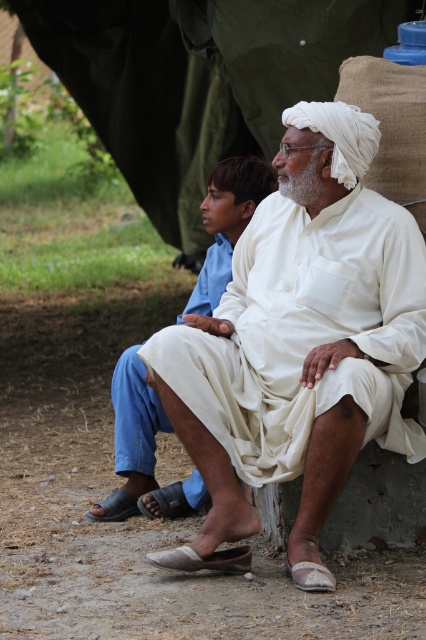
You are an anthropologist observing two people in a rural setting. You notice the white cotton kurta at center and the white cotton dhoti at center. Which clothing item is positioned to the right?

The white cotton kurta at center is to the right of the white cotton dhoti at center, so the kurta is positioned to the right.

You are a tailor measuring cloth for a customer. You have a 36 inch long white cotton fabric. The customer wants to make both the white cotton turban at upper center and the white cotton dhoti at center. Can the fabric be cut into two pieces to make both items without any leftover material?

The white cotton turban at upper center and white cotton dhoti at center are 34.34 inches apart. Since the total required length is 34.34 inches and the fabric is 36 inches long, there will be 1.66 inches of leftover material. Therefore, the fabric can be cut into two pieces for both items with some leftover material.

You are a photographer trying to capture a detailed shot of both the white cotton turban at upper center and the white cotton dhoti at center. Since you can only focus on one object at a time, which one should you focus on first to ensure it appears sharp in the photo?

You should focus on the white cotton turban at upper center first because it is closer to the viewer than the white cotton dhoti at center, so adjusting focus from near to far will help both appear sharp.